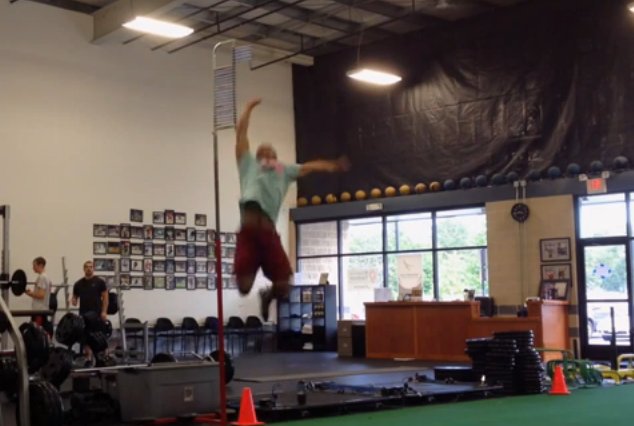
In order to click on yellowish tannish wall in this screenshot , I will do `click(503, 263)`.